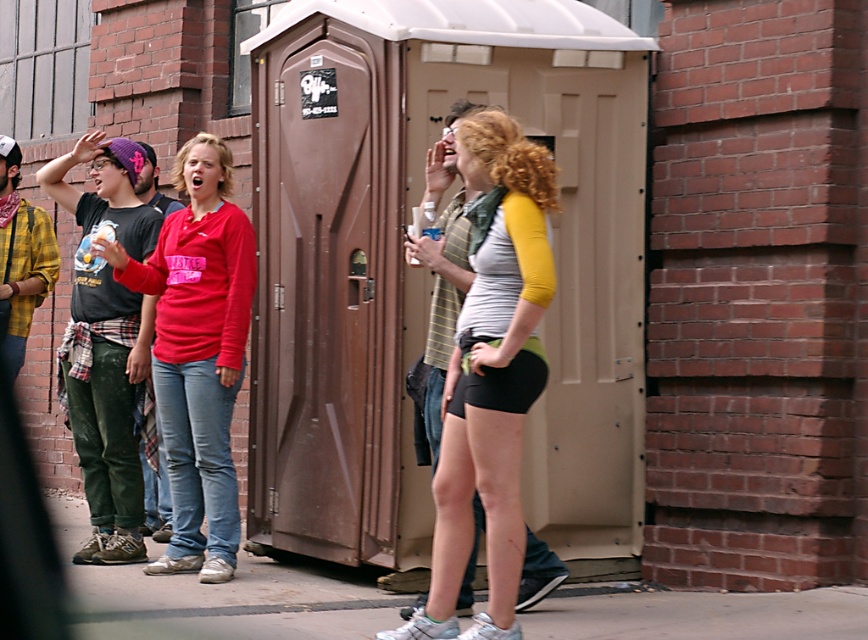
Question: Does matte gray shorts at center lie in front of matte red shirt at center?

Choices:
 (A) no
 (B) yes

Answer: (B)

Question: Which object is farther from the camera taking this photo?

Choices:
 (A) matte red shirt at center
 (B) matte gray shorts at center

Answer: (A)

Question: Considering the relative positions of matte gray shorts at center and matte red shirt at center in the image provided, where is matte gray shorts at center located with respect to matte red shirt at center?

Choices:
 (A) below
 (B) above

Answer: (A)

Question: Among these objects, which one is farthest from the camera?

Choices:
 (A) matte gray shorts at center
 (B) matte red shirt at center

Answer: (B)

Question: Can you confirm if matte gray shorts at center is wider than matte red shirt at center?

Choices:
 (A) no
 (B) yes

Answer: (A)